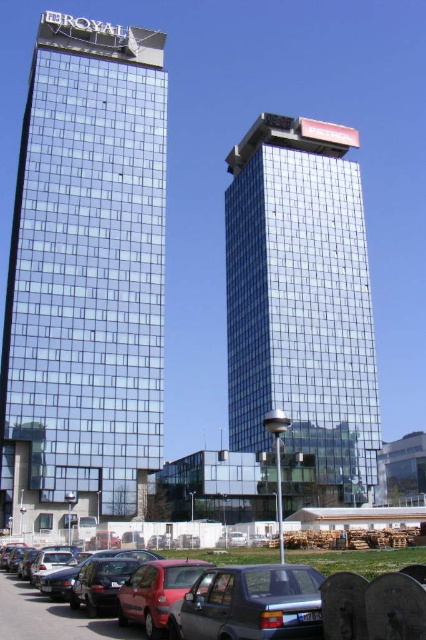
You are standing at the entrance of the parking area in front of the skyscrapers. You see the metallic silver car at lower center. If you want to reach the car quickly, which direction should you walk towards?

Since the metallic silver car at lower center is located at point 0.964 on the x axis and 0.117 on the y axis, you should walk towards the lower center direction to reach the car quickly.

You are a delivery driver who needs to park your 2.5 meter wide truck in the parking lot between the shiny glass building at left and the shiny glass tower at center. Given that the distance between these two buildings is exactly the combined width of both buildings, can your truck fit between them without touching either building?

The shiny glass building at left has a lesser width compared to the shiny glass tower at center. Since the distance between them is the combined width of both buildings, the total space available would be the sum of their widths. Subtracting the truck width of 2.5 meters from this total would leave enough space to park without touching either building, so yes, the truck can fit.